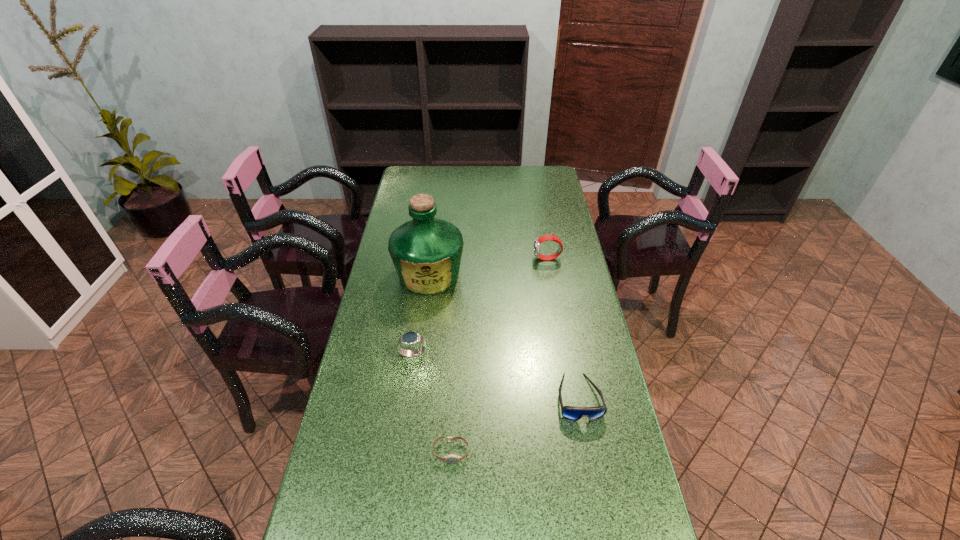
Where is `free spot between the farthest watch and the second shortest object`? free spot between the farthest watch and the second shortest object is located at coordinates (563, 328).

This screenshot has height=540, width=960. Identify the location of unoccupied position between the second shortest watch and the farthest watch. (480, 307).

Image resolution: width=960 pixels, height=540 pixels. I want to click on free area in between the fourth shortest object and the tallest object, so tap(489, 267).

Where is `vacant space in between the fourth tallest object and the third nearest object`? vacant space in between the fourth tallest object and the third nearest object is located at coordinates (495, 376).

You are a GUI agent. You are given a task and a screenshot of the screen. Output one action in this format:
    pyautogui.click(x=<x>, y=<y>)
    Task: Click on the free area in between the second nearest watch and the fourth tallest object
    
    Given the screenshot: What is the action you would take?
    pyautogui.click(x=495, y=376)

Locate an element on the screen. object that ranks as the third closest to the third shortest object is located at coordinates (573, 413).

Locate an element on the screen. object identified as the fourth closest to the tallest object is located at coordinates (451, 458).

The height and width of the screenshot is (540, 960). Identify the location of the second closest watch relative to the tallest object. (539, 240).

Find the location of a particular element. watch that stands as the second closest to the second shortest object is located at coordinates (410, 338).

The height and width of the screenshot is (540, 960). I want to click on free point that satisfies the following two spatial constraints: 1. on the face of the second tallest object; 2. on the label side of the tallest object, so click(550, 275).